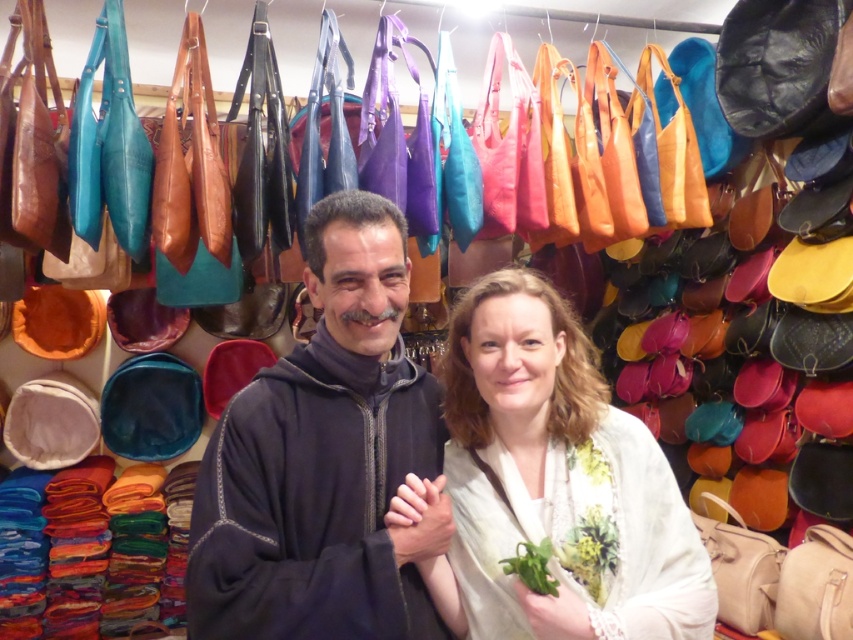
Between dark blue fabric at center and matte white scarf at center, which one has more height?

dark blue fabric at center

Which is above, dark blue fabric at center or matte white scarf at center?

dark blue fabric at center is higher up.

Is point (221, 468) farther from camera compared to point (650, 616)?

That is False.

The width and height of the screenshot is (853, 640). I want to click on dark blue fabric at center, so click(323, 460).